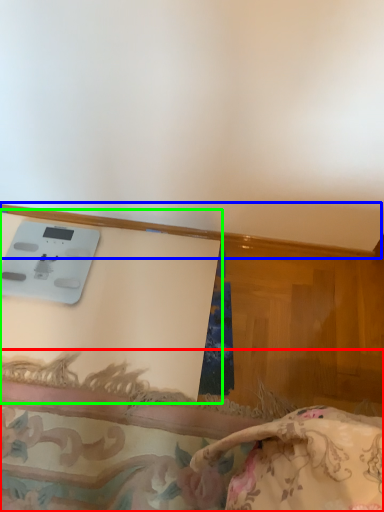
Question: Which object is the closest to the furniture (highlighted by a red box)? Choose among these: trim (highlighted by a blue box) or table (highlighted by a green box).

Choices:
 (A) trim
 (B) table

Answer: (B)